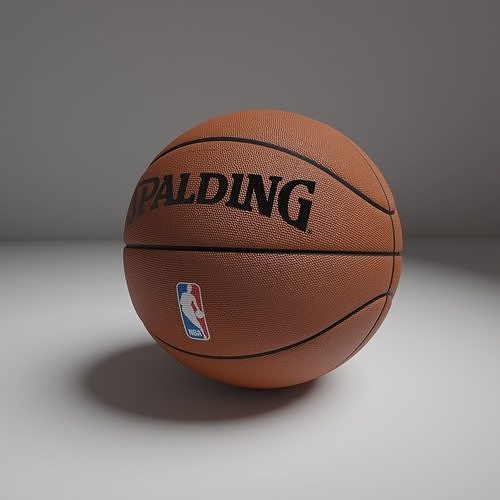
Where is `wall`? wall is located at coordinates (94, 79).